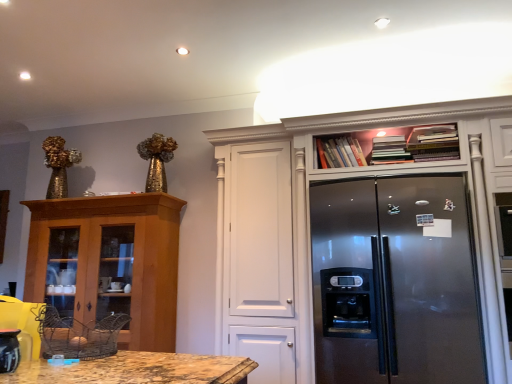
Question: Would you say satin silver refrigerator at upper right, the second cabinetry in the left-to-right sequence, is outside satin silver refrigerator at center?

Choices:
 (A) yes
 (B) no

Answer: (B)

Question: From a real-world perspective, does satin silver refrigerator at upper right, which appears as the 1th cabinetry when viewed from the right, stand above satin silver refrigerator at center?

Choices:
 (A) yes
 (B) no

Answer: (A)

Question: From a real-world perspective, is satin silver refrigerator at upper right, which appears as the 1th cabinetry when viewed from the right, beneath satin silver refrigerator at center?

Choices:
 (A) no
 (B) yes

Answer: (A)

Question: Is satin silver refrigerator at upper right, the second cabinetry in the left-to-right sequence, closer to the viewer compared to satin silver refrigerator at center?

Choices:
 (A) yes
 (B) no

Answer: (A)

Question: Is satin silver refrigerator at center surrounded by satin silver refrigerator at upper right, which appears as the 1th cabinetry when viewed from the right?

Choices:
 (A) no
 (B) yes

Answer: (B)

Question: Considering the positions of matte black coffee pot at lower left and wooden cabinet at left, which ranks as the 1th cabinetry in left-to-right order, in the image, is matte black coffee pot at lower left taller or shorter than wooden cabinet at left, which ranks as the 1th cabinetry in left-to-right order,?

Choices:
 (A) tall
 (B) short

Answer: (B)

Question: Considering the positions of matte black coffee pot at lower left and wooden cabinet at left, positioned as the second cabinetry in right-to-left order, in the image, is matte black coffee pot at lower left wider or thinner than wooden cabinet at left, positioned as the second cabinetry in right-to-left order,?

Choices:
 (A) wide
 (B) thin

Answer: (B)

Question: From a real-world perspective, is matte black coffee pot at lower left physically located above or below wooden cabinet at left, which ranks as the 1th cabinetry in left-to-right order?

Choices:
 (A) below
 (B) above

Answer: (A)

Question: Does point (9, 344) appear closer or farther from the camera than point (36, 297)?

Choices:
 (A) closer
 (B) farther

Answer: (A)

Question: Considering their positions, is wooden cabinet at left, positioned as the second cabinetry in right-to-left order, located in front of or behind satin silver refrigerator at center?

Choices:
 (A) behind
 (B) front

Answer: (A)

Question: Would you say wooden cabinet at left, positioned as the second cabinetry in right-to-left order, is to the left or to the right of satin silver refrigerator at center in the picture?

Choices:
 (A) right
 (B) left

Answer: (B)

Question: In terms of height, does wooden cabinet at left, which ranks as the 1th cabinetry in left-to-right order, look taller or shorter compared to satin silver refrigerator at center?

Choices:
 (A) short
 (B) tall

Answer: (A)

Question: From the image's perspective, is wooden cabinet at left, positioned as the second cabinetry in right-to-left order, located above or below satin silver refrigerator at center?

Choices:
 (A) above
 (B) below

Answer: (B)

Question: Is satin silver refrigerator at center in front of or behind wooden cabinet at left, positioned as the second cabinetry in right-to-left order, in the image?

Choices:
 (A) front
 (B) behind

Answer: (A)

Question: Considering the positions of satin silver refrigerator at center and wooden cabinet at left, which ranks as the 1th cabinetry in left-to-right order, in the image, is satin silver refrigerator at center taller or shorter than wooden cabinet at left, which ranks as the 1th cabinetry in left-to-right order,?

Choices:
 (A) tall
 (B) short

Answer: (A)